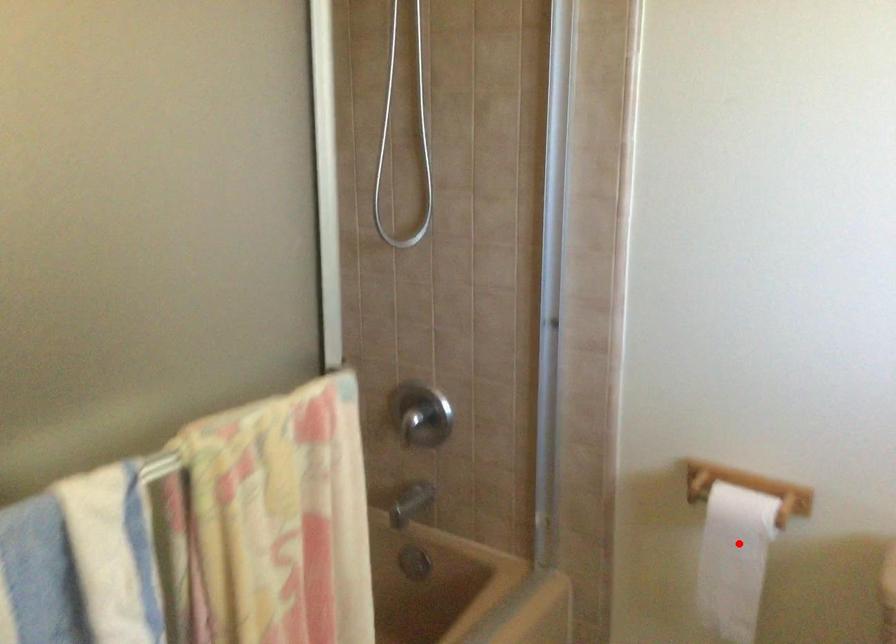
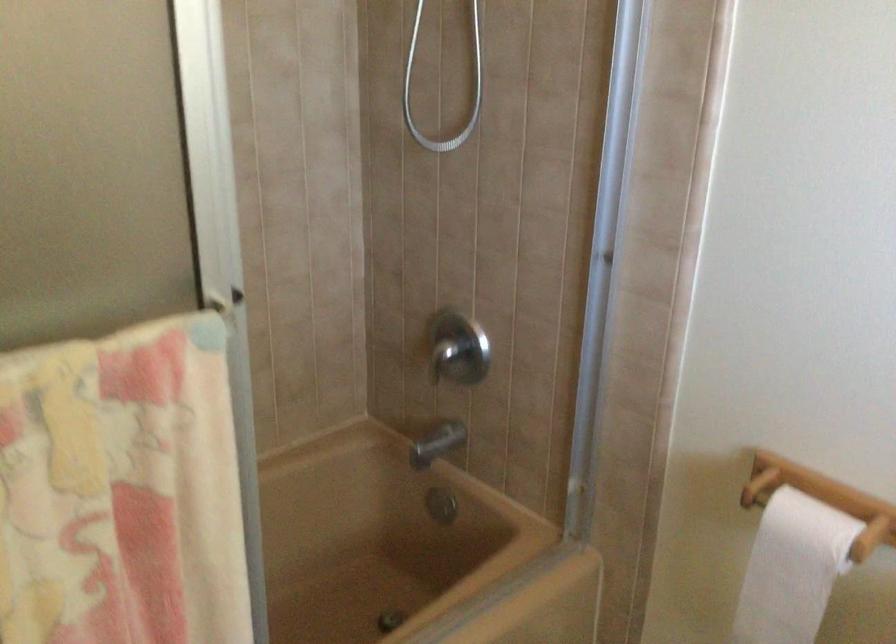
The point at the highlighted location is marked in the first image. Where is the corresponding point in the second image?

(791, 569)